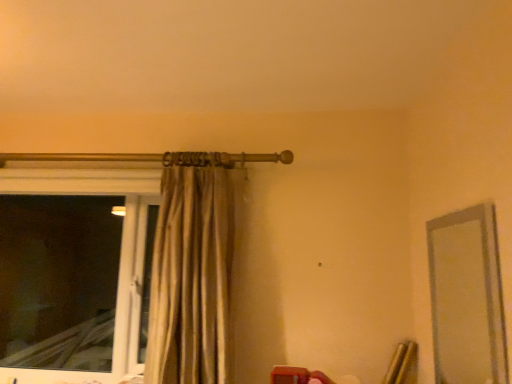
Question: From a real-world perspective, is transparent glass window at left physically above beige fabric curtain at upper center?

Choices:
 (A) no
 (B) yes

Answer: (A)

Question: Is the depth of transparent glass window at left greater than that of beige fabric curtain at upper center?

Choices:
 (A) yes
 (B) no

Answer: (A)

Question: Does transparent glass window at left have a lesser width compared to beige fabric curtain at upper center?

Choices:
 (A) yes
 (B) no

Answer: (A)

Question: Is transparent glass window at left located outside beige fabric curtain at upper center?

Choices:
 (A) no
 (B) yes

Answer: (B)

Question: Would you consider transparent glass window at left to be distant from beige fabric curtain at upper center?

Choices:
 (A) yes
 (B) no

Answer: (A)

Question: Is transparent glass window at left oriented away from beige fabric curtain at upper center?

Choices:
 (A) yes
 (B) no

Answer: (B)

Question: Is clear glass mirror at right outside beige fabric curtain at upper center?

Choices:
 (A) no
 (B) yes

Answer: (B)

Question: Is clear glass mirror at right thinner than beige fabric curtain at upper center?

Choices:
 (A) no
 (B) yes

Answer: (B)

Question: Considering the relative positions of clear glass mirror at right and beige fabric curtain at upper center in the image provided, is clear glass mirror at right to the left of beige fabric curtain at upper center from the viewer's perspective?

Choices:
 (A) yes
 (B) no

Answer: (B)

Question: From a real-world perspective, does clear glass mirror at right sit lower than beige fabric curtain at upper center?

Choices:
 (A) yes
 (B) no

Answer: (A)

Question: Can you confirm if clear glass mirror at right is positioned to the right of beige fabric curtain at upper center?

Choices:
 (A) no
 (B) yes

Answer: (B)

Question: From the image's perspective, is clear glass mirror at right above beige fabric curtain at upper center?

Choices:
 (A) yes
 (B) no

Answer: (B)

Question: From a real-world perspective, is clear glass mirror at right under transparent glass window at left?

Choices:
 (A) no
 (B) yes

Answer: (A)